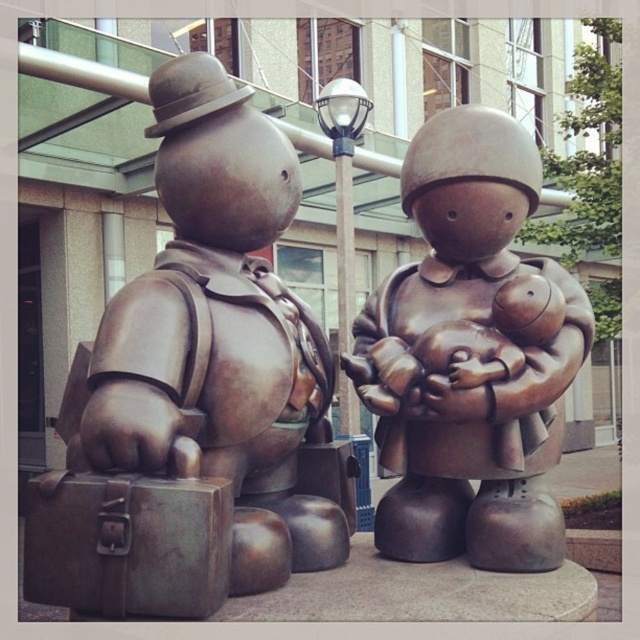
Is bronze statue at center to the right of bronze suitcase at lower left from the viewer's perspective?

Yes, bronze statue at center is to the right of bronze suitcase at lower left.

Which is in front, point (532, 198) or point (77, 556)?

Point (77, 556) is in front.

The width and height of the screenshot is (640, 640). I want to click on bronze statue at center, so click(x=467, y=356).

Is brushed metal briefcase at left taller than bronze statue at center?

Indeed, brushed metal briefcase at left has a greater height compared to bronze statue at center.

Image resolution: width=640 pixels, height=640 pixels. I want to click on brushed metal briefcase at left, so click(220, 337).

Find the location of a particular element. The height and width of the screenshot is (640, 640). brushed metal briefcase at left is located at coordinates (220, 337).

Can you confirm if brushed metal briefcase at left is positioned to the right of bronze suitcase at lower left?

Indeed, brushed metal briefcase at left is positioned on the right side of bronze suitcase at lower left.

Which is below, brushed metal briefcase at left or bronze suitcase at lower left?

bronze suitcase at lower left is lower down.

Which is behind, point (300, 541) or point (212, 588)?

The point (300, 541) is more distant.

Find the location of a particular element. This screenshot has height=640, width=640. brushed metal briefcase at left is located at coordinates (220, 337).